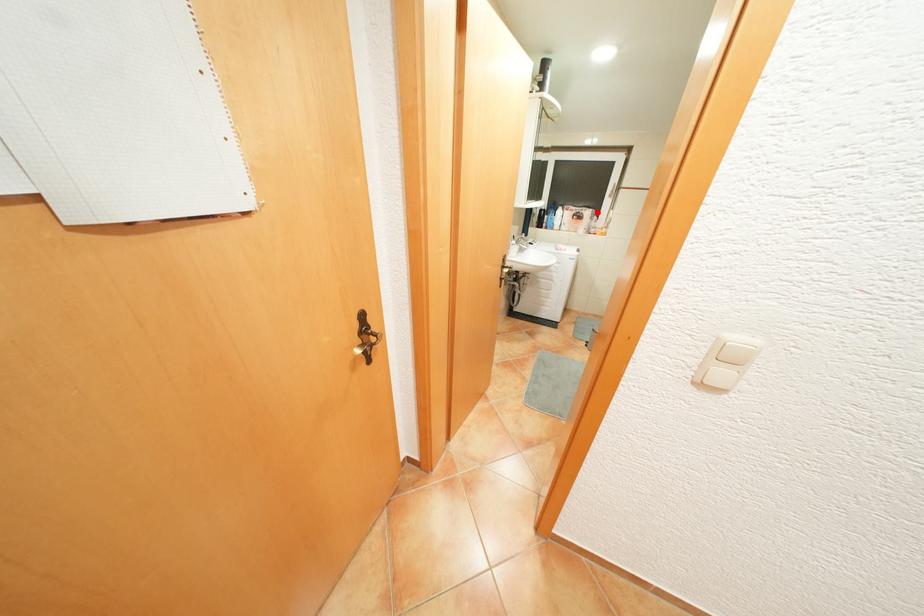
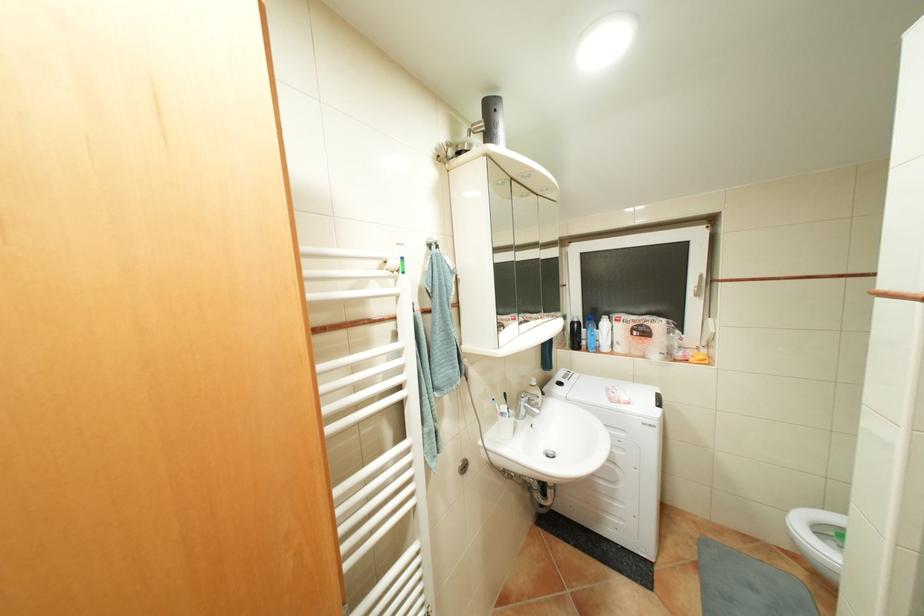
Question: I am providing you with two images of the same scene from different viewpoints. A red point is shown in image1. For the corresponding object point in image2, is it positioned nearer or farther from the camera?

Choices:
 (A) Nearer
 (B) Farther

Answer: (B)